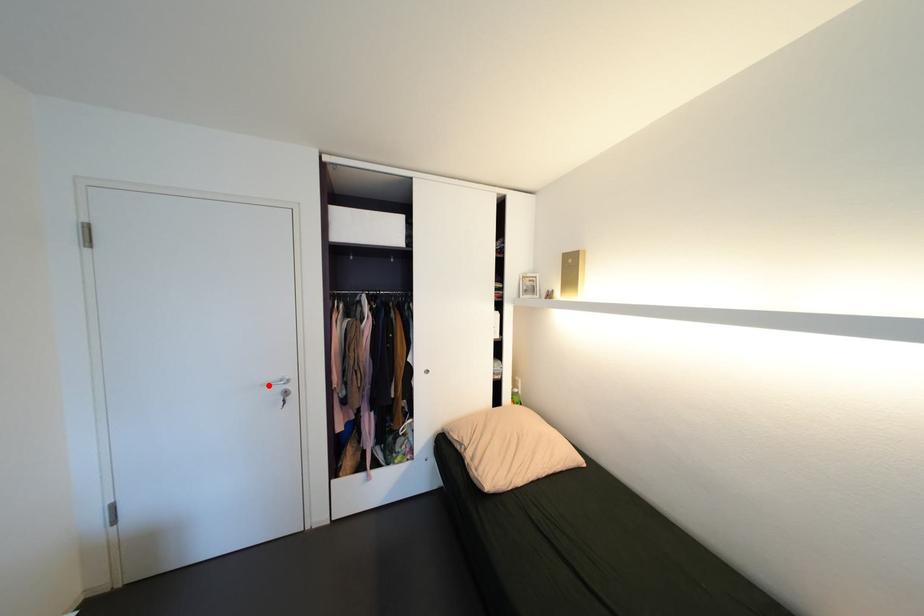
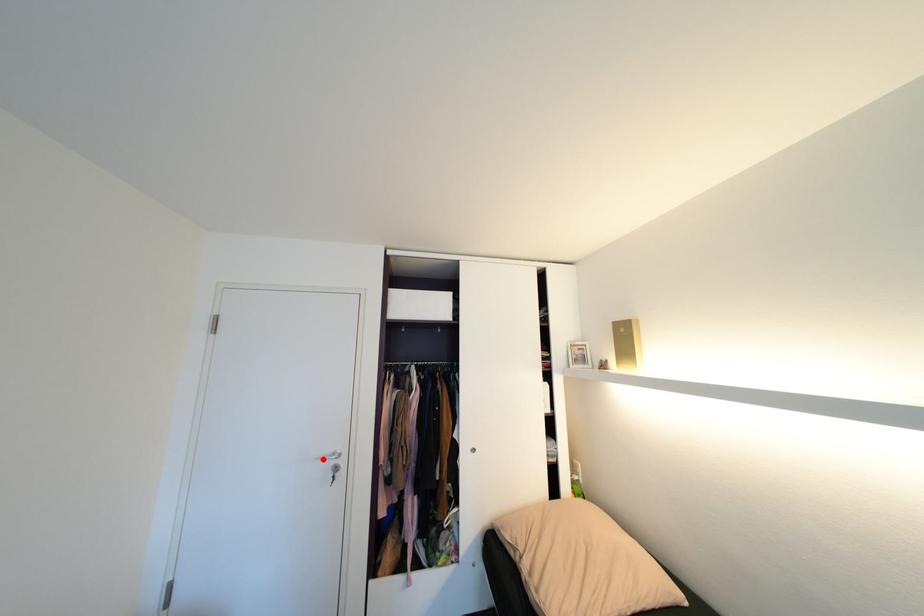
I am providing you with two images of the same scene from different viewpoints. A red point is marked on the first image and another point is marked on the second image. Is the marked point in image1 the same physical position as the marked point in image2?

Yes